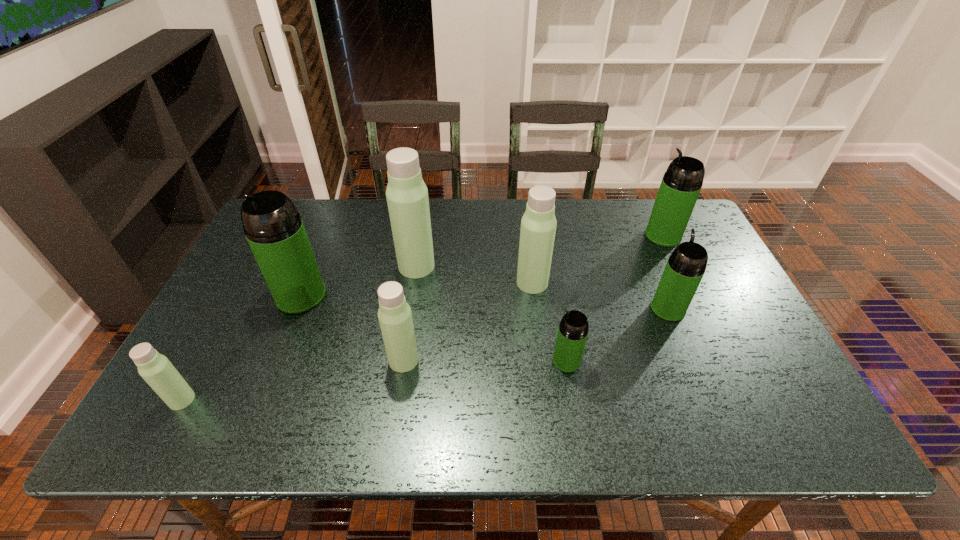
Find the location of `free location located 0.220m from the spout of the second smallest green thermos bottle`. free location located 0.220m from the spout of the second smallest green thermos bottle is located at coordinates (641, 245).

Locate an element on the screen. Image resolution: width=960 pixels, height=540 pixels. blank space located 0.110m on the right of the third biggest light thermos bottle is located at coordinates (465, 360).

At what (x,y) coordinates should I click in order to perform the action: click on free spot located from the spout of the smallest green thermos bottle. Please return your answer as a coordinate pair (x, y). The width and height of the screenshot is (960, 540). Looking at the image, I should click on (384, 361).

Where is `vacant space positioned 0.220m from the spout of the smallest green thermos bottle`? Image resolution: width=960 pixels, height=540 pixels. vacant space positioned 0.220m from the spout of the smallest green thermos bottle is located at coordinates (460, 361).

You are a GUI agent. You are given a task and a screenshot of the screen. Output one action in this format:
    pyautogui.click(x=<x>, y=<y>)
    Task: Click on the vacant space located 0.240m from the spout of the smallest green thermos bottle
    This screenshot has width=960, height=540.
    Given the screenshot: What is the action you would take?
    pyautogui.click(x=451, y=361)

Find the location of a particular element. The height and width of the screenshot is (540, 960). free space located 0.350m on the back of the leftmost light thermos bottle is located at coordinates (247, 281).

Find the location of a particular element. object that is at the far edge is located at coordinates (681, 184).

Identify the location of object that is at the near edge. (156, 369).

Where is `object present at the near left corner`? The width and height of the screenshot is (960, 540). object present at the near left corner is located at coordinates (156, 369).

Where is `object present at the far right corner`? The height and width of the screenshot is (540, 960). object present at the far right corner is located at coordinates (681, 184).